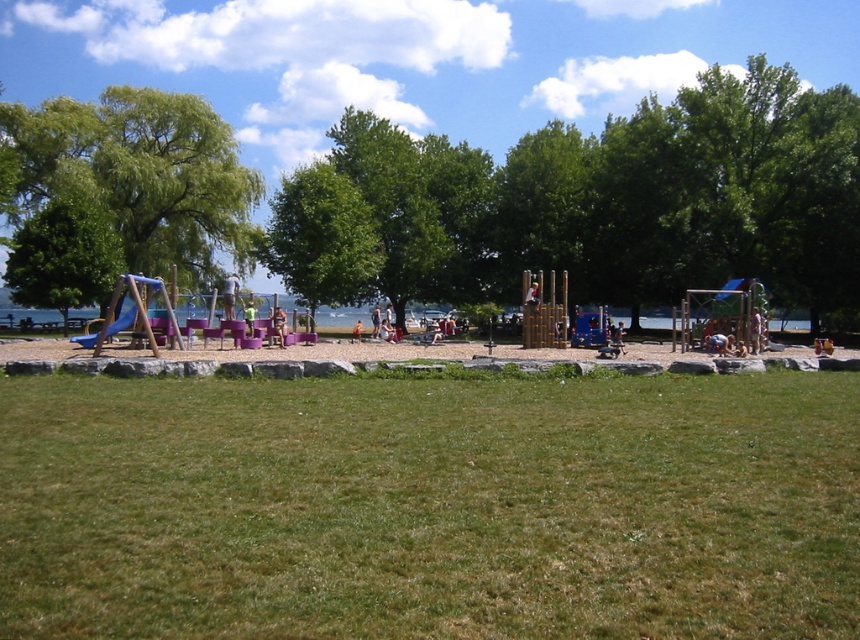
Question: Does green grass at lower center have a greater width compared to blue rubber slide at left?

Choices:
 (A) yes
 (B) no

Answer: (A)

Question: Estimate the real-world distances between objects in this image. Which object is closer to the green leafy tree at center?

Choices:
 (A) blue rubber slide at left
 (B) green grass at lower center
 (C) gravelly sand at center
 (D) green leafy tree at left

Answer: (D)

Question: Does green grass at lower center appear on the right side of green leafy tree at left?

Choices:
 (A) yes
 (B) no

Answer: (A)

Question: Which point appears farthest from the camera in this image?

Choices:
 (A) (66, 454)
 (B) (379, 285)

Answer: (B)

Question: Where is green leafy tree at center located in relation to blue rubber slide at left in the image?

Choices:
 (A) below
 (B) above

Answer: (B)

Question: Among these points, which one is nearest to the camera?

Choices:
 (A) coord(409,188)
 (B) coord(4,346)

Answer: (B)